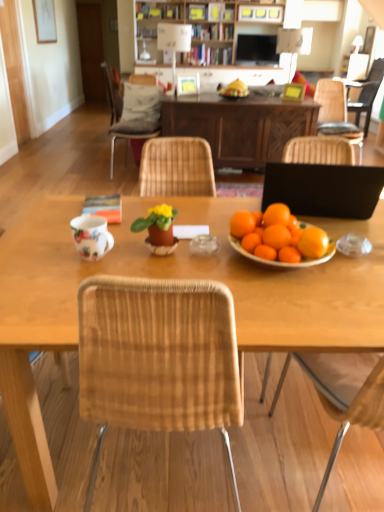
Question: In terms of height, does woven wood chair at upper left, the second chair positioned from the back, look taller or shorter compared to wooden table at center?

Choices:
 (A) short
 (B) tall

Answer: (B)

Question: Which is correct: woven wood chair at upper left, which ranks as the 3th chair in right-to-left order, is inside wooden table at center, or outside of it?

Choices:
 (A) outside
 (B) inside

Answer: (A)

Question: Which of these objects is positioned closest to the matte white picture frame at upper left, which ranks as the 3th picture frame in front-to-back order?

Choices:
 (A) matte white picture frame at center, the second picture frame ordered from the bottom
 (B) woven wood chair at upper left, which ranks as the 3th chair in right-to-left order
 (C) wooden cabinet at upper center
 (D) wooden table at center
 (E) matte black television at upper center

Answer: (C)

Question: Which object is positioned closest to the white fabric pillow at upper left?

Choices:
 (A) woven wood chair at right, which is the 2th chair from left to right
 (B) matte clay pot at center
 (C) woven wood chair at upper right, the 1th chair positioned from the back
 (D) wooden table at center
 (E) woven wood chair at upper left, which ranks as the 3th chair in right-to-left order

Answer: (E)